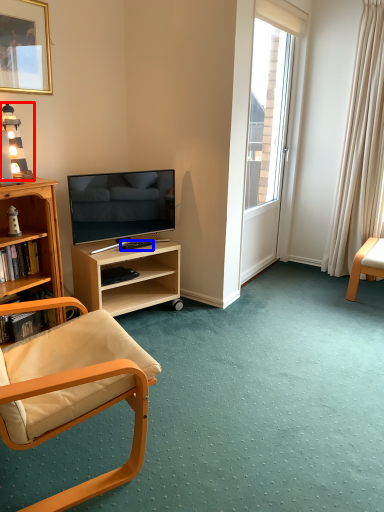
Question: Which of the following is the farthest to the observer, lamp (highlighted by a red box) or remote control (highlighted by a blue box)?

Choices:
 (A) lamp
 (B) remote control

Answer: (B)